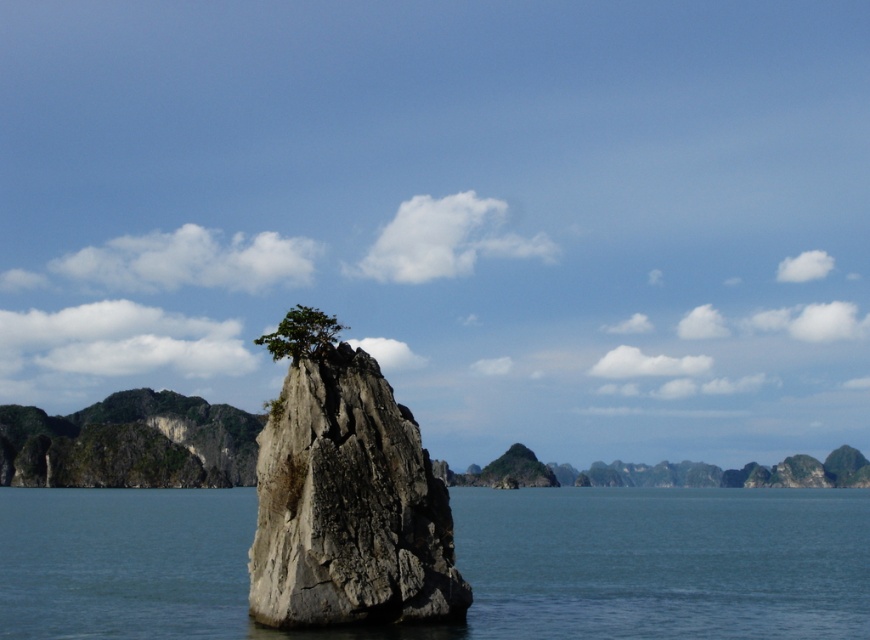
Is clear blue water at center smaller than gray rough rock at center?

Actually, clear blue water at center might be larger than gray rough rock at center.

Based on the photo, does clear blue water at center appear over gray rough rock at center?

No, clear blue water at center is not above gray rough rock at center.

The height and width of the screenshot is (640, 870). Find the location of `clear blue water at center`. clear blue water at center is located at coordinates (456, 563).

Is clear blue water at center shorter than green leafy tree at center?

Incorrect, clear blue water at center's height does not fall short of green leafy tree at center's.

This screenshot has width=870, height=640. I want to click on clear blue water at center, so click(456, 563).

What are the coordinates of `clear blue water at center` in the screenshot? It's located at click(x=456, y=563).

Does gray rough rock at center have a lesser height compared to green leafy tree at center?

Incorrect, gray rough rock at center's height does not fall short of green leafy tree at center's.

Is gray rough rock at center above green leafy tree at center?

Incorrect, gray rough rock at center is not positioned above green leafy tree at center.

What do you see at coordinates (348, 506) in the screenshot? Image resolution: width=870 pixels, height=640 pixels. I see `gray rough rock at center` at bounding box center [348, 506].

Where is `gray rough rock at center`? gray rough rock at center is located at coordinates (348, 506).